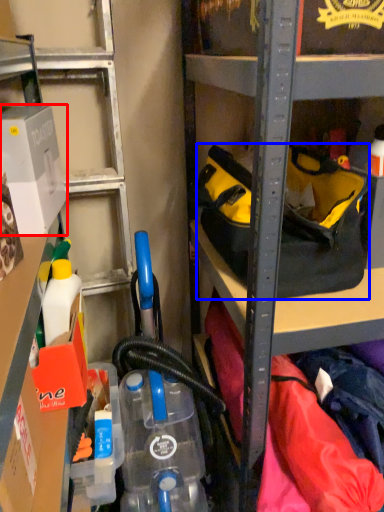
Question: Which object appears farthest to the camera in this image, box (highlighted by a red box) or handbag (highlighted by a blue box)?

Choices:
 (A) box
 (B) handbag

Answer: (B)